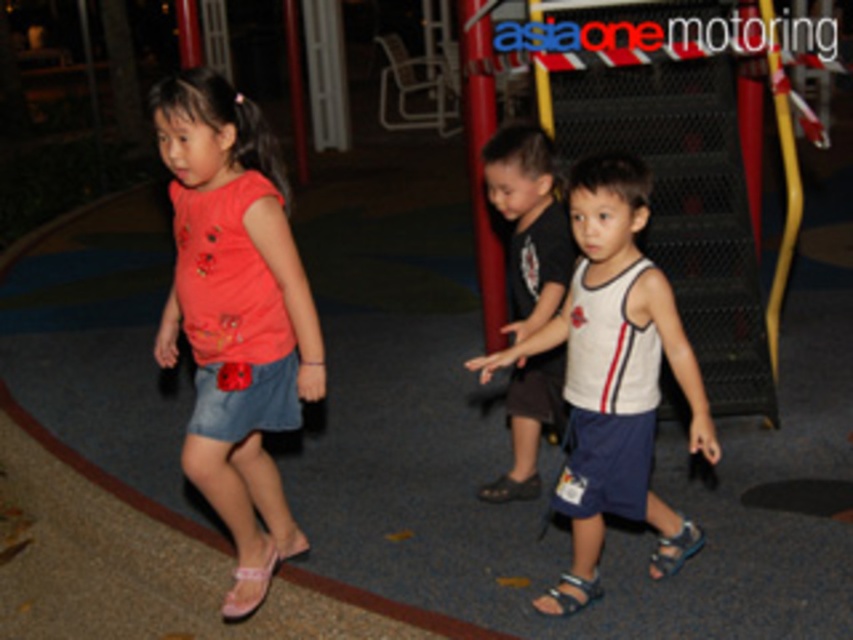
Question: Is pink fabric sandal at lower left wider than blue fabric sandal at lower center?

Choices:
 (A) yes
 (B) no

Answer: (A)

Question: Which object is farther from the camera taking this photo?

Choices:
 (A) pink fabric sandal at lower left
 (B) light brown leather sandal at lower center
 (C) matte coral t-shirt at center
 (D) white cotton shirt at center

Answer: (D)

Question: Which point is closer to the camera taking this photo?

Choices:
 (A) (590, 214)
 (B) (529, 209)
 (C) (268, 550)

Answer: (A)

Question: Is matte coral t-shirt at center bigger than white cotton tank top at center?

Choices:
 (A) no
 (B) yes

Answer: (B)

Question: Which object appears farthest from the camera in this image?

Choices:
 (A) light brown leather sandal at lower center
 (B) matte coral t-shirt at center
 (C) white cotton tank top at center
 (D) white cotton shirt at center

Answer: (D)

Question: Does matte coral t-shirt at center appear over white cotton tank top at center?

Choices:
 (A) yes
 (B) no

Answer: (A)